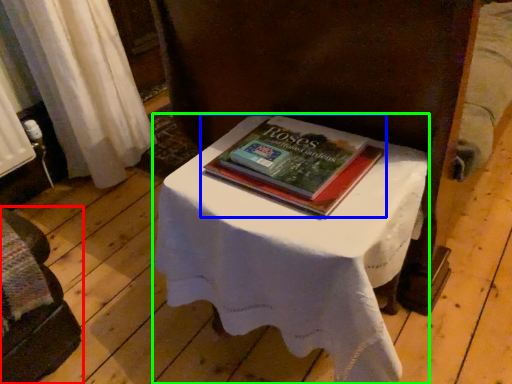
Question: Based on their relative distances, which object is nearer to furniture (highlighted by a red box)? Choose from book (highlighted by a blue box) and table (highlighted by a green box).

Choices:
 (A) book
 (B) table

Answer: (B)